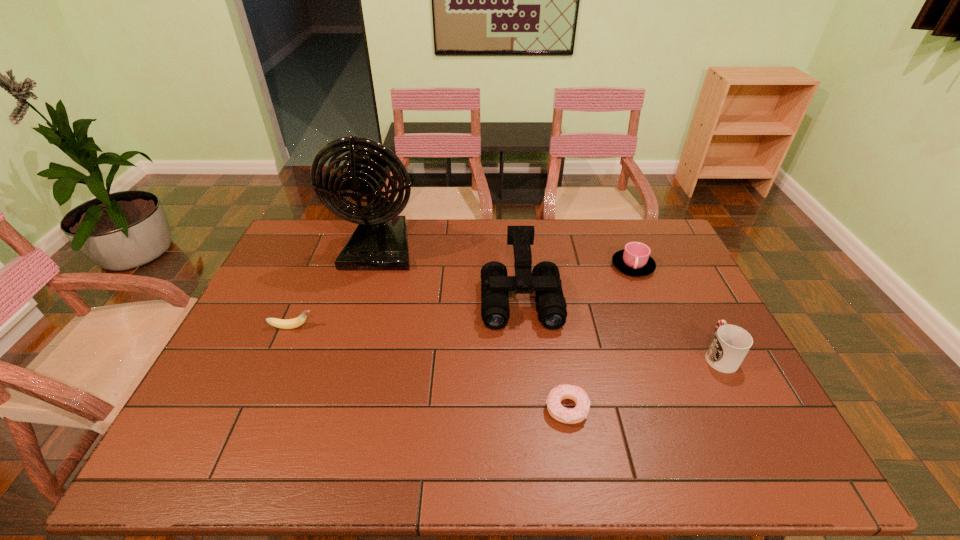
Find the location of a particular element. This screenshot has width=960, height=540. fan is located at coordinates (380, 242).

Find the location of a particular element. The width and height of the screenshot is (960, 540). binoculars is located at coordinates (544, 279).

The image size is (960, 540). I want to click on the right cup, so click(x=731, y=343).

I want to click on the taller cup, so click(x=731, y=343).

Where is `the shorter cup`? the shorter cup is located at coordinates (635, 259).

You are a GUI agent. You are given a task and a screenshot of the screen. Output one action in this format:
    pyautogui.click(x=<x>, y=<y>)
    Task: Click on the farther cup
    
    Given the screenshot: What is the action you would take?
    pyautogui.click(x=635, y=259)

Image resolution: width=960 pixels, height=540 pixels. Identify the location of banana. (296, 322).

The image size is (960, 540). I want to click on the shortest object, so click(561, 414).

Image resolution: width=960 pixels, height=540 pixels. Identify the location of the nearest object. (561, 414).

Identify the location of vacant region located 0.380m in front of the fan to blow air. Image resolution: width=960 pixels, height=540 pixels. [x=346, y=370].